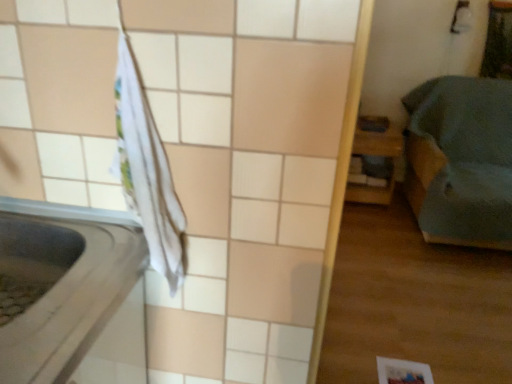
Question: Is point (386, 377) positioned closer to the camera than point (501, 145)?

Choices:
 (A) farther
 (B) closer

Answer: (B)

Question: In the image, is white matte paper at lower right on the left side or the right side of teal fabric bed at right, positioned as the second furniture in left-to-right order?

Choices:
 (A) left
 (B) right

Answer: (A)

Question: Which object is the farthest from the teal fabric bed at right, the 1th furniture positioned from the right?

Choices:
 (A) wooden shelf at right, which is counted as the first furniture, starting from the left
 (B) white fabric at left
 (C) white matte paper at lower right

Answer: (B)

Question: Which object is positioned farthest from the wooden shelf at right, the second furniture when ordered from right to left?

Choices:
 (A) teal fabric bed at right, the 1th furniture positioned from the right
 (B) white matte paper at lower right
 (C) white fabric at left

Answer: (C)